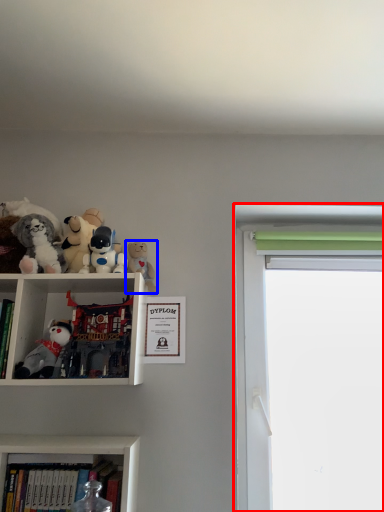
Question: Which object appears closest to the camera in this image, window screen (highlighted by a red box) or toy (highlighted by a blue box)?

Choices:
 (A) window screen
 (B) toy

Answer: (B)